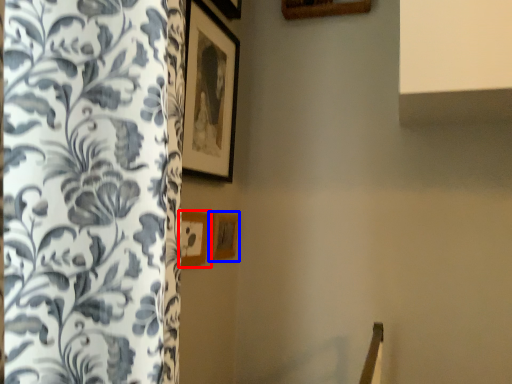
Question: Which of the following is the closest to the observer, picture frame (highlighted by a red box) or picture frame (highlighted by a blue box)?

Choices:
 (A) picture frame
 (B) picture frame

Answer: (A)